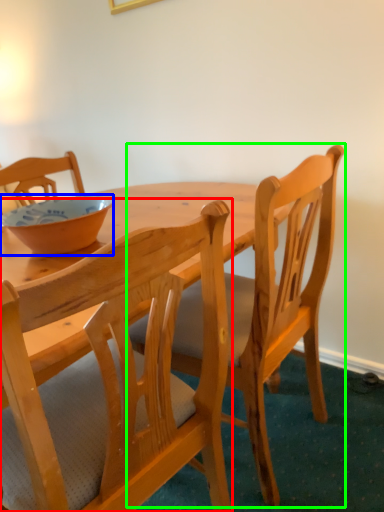
Question: Which object is the closest to the chair (highlighted by a red box)? Choose among these: bowl (highlighted by a blue box) or chair (highlighted by a green box).

Choices:
 (A) bowl
 (B) chair

Answer: (B)